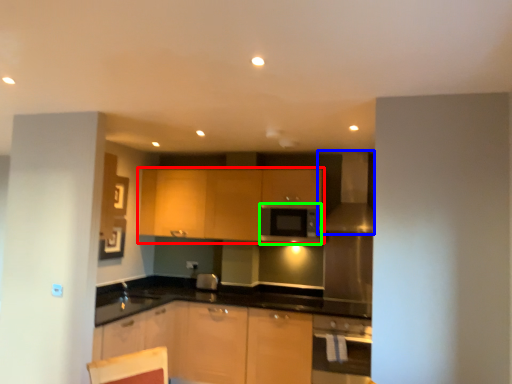
Question: Which object is the farthest from cabinetry (highlighted by a red box)? Choose among these: exhaust hood (highlighted by a blue box) or appliance (highlighted by a green box).

Choices:
 (A) exhaust hood
 (B) appliance

Answer: (A)